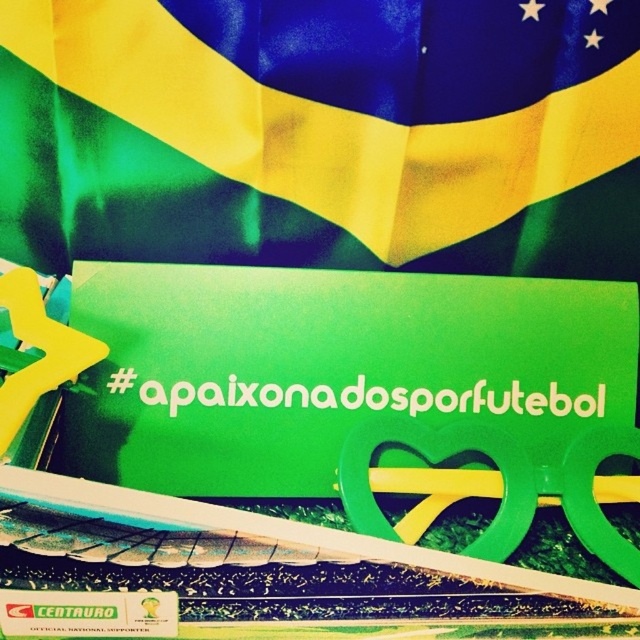
You are at a Brazilian football event and see the green fabric flag at upper center and the green matte sign at center. Which object is positioned higher in the image?

The green fabric flag at upper center is positioned higher than the green matte sign at center.

You are a soccer fan visiting a Brazilian cultural exhibition. You notice two green items in the display case. One is the green fabric flag at upper center and the other is the green matte sign at center. Which of these two items is taller?

The green fabric flag at upper center is much taller than the green matte sign at center.

You are a photographer setting up a shot of the green fabric flag at upper center and the green matte sign at center. You want to ensure both are in focus. Given that your camera has a depth of field that can cover 18 centimeters, will both objects be in focus?

The green fabric flag at upper center is 17.69 centimeters from the green matte sign at center. Since the distance between them is less than the camera depth of field of 18 centimeters, both objects will be in focus.